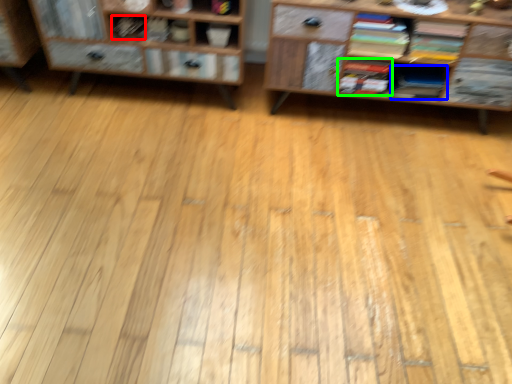
Question: Estimate the real-world distances between objects in this image. Which object is closer to book (highlighted by a red box), book (highlighted by a blue box) or book (highlighted by a green box)?

Choices:
 (A) book
 (B) book

Answer: (B)